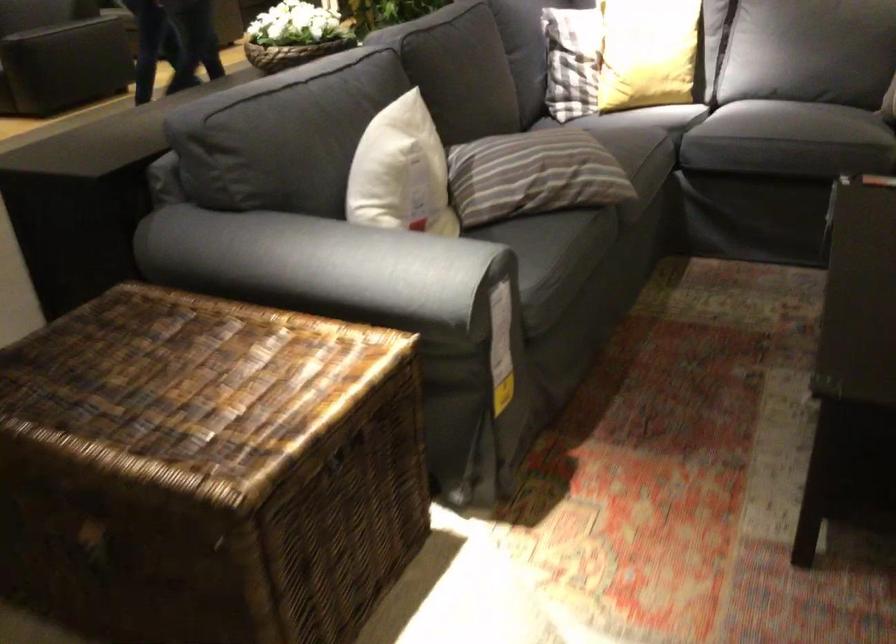
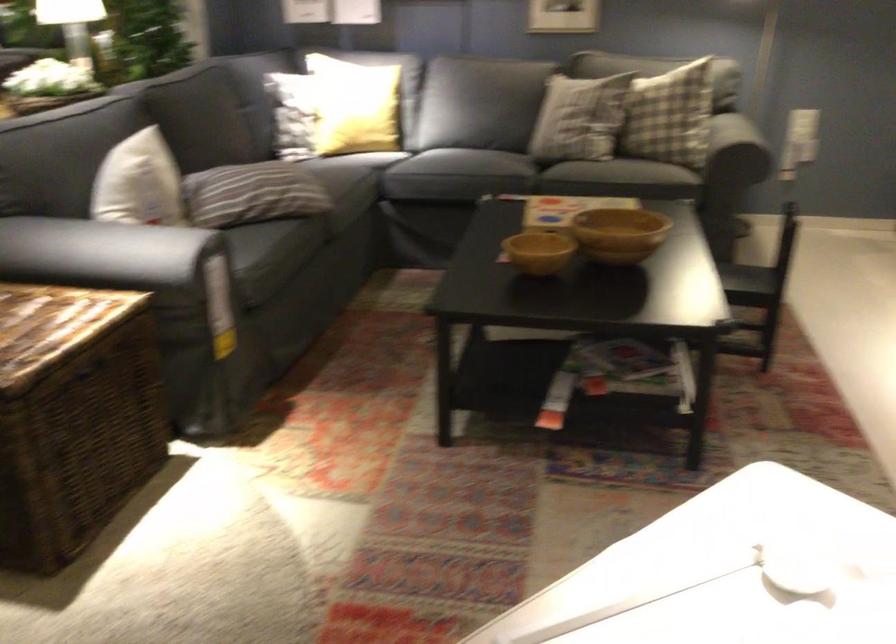
The point at (373, 272) is marked in the first image. Where is the corresponding point in the second image?

(117, 252)